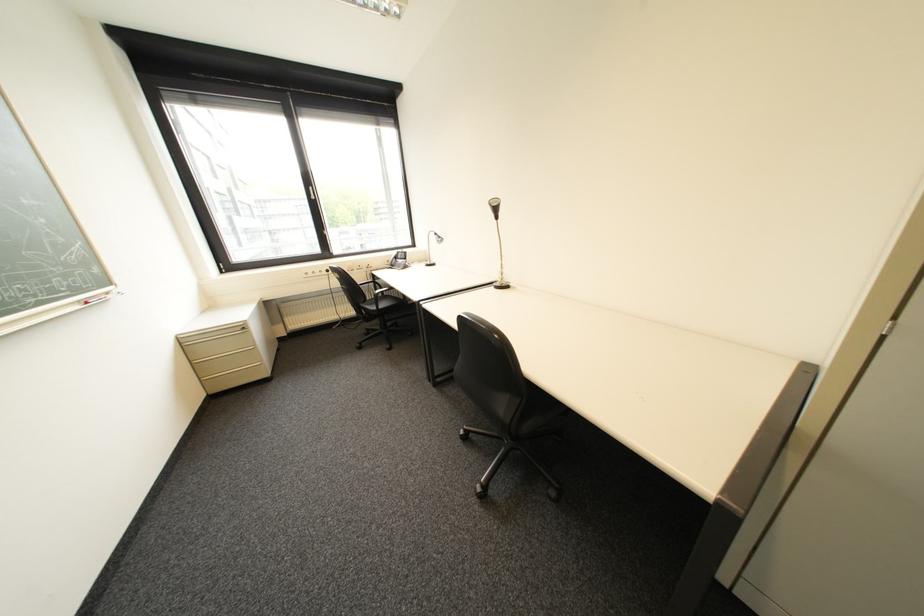
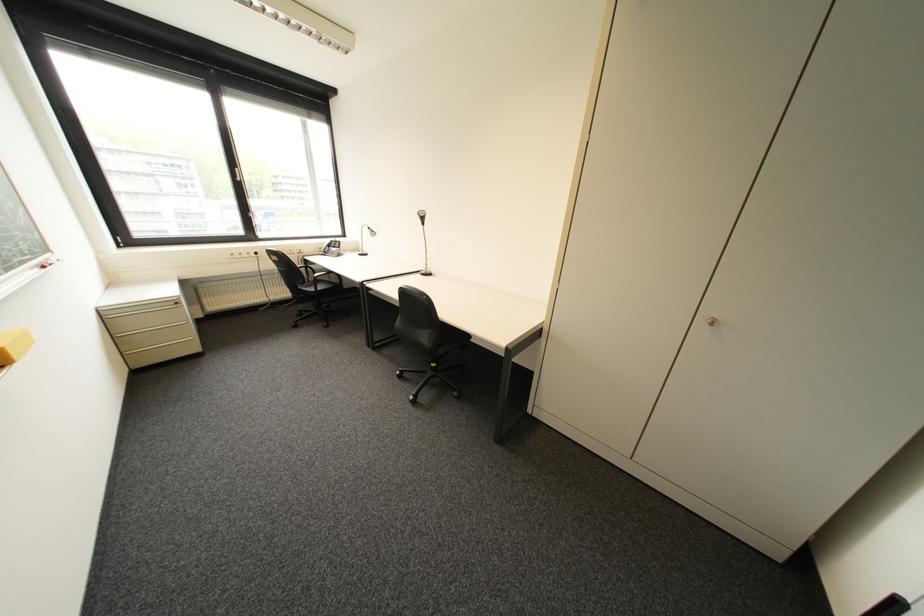
The point at (377, 333) is marked in the first image. Where is the corresponding point in the second image?

(309, 314)